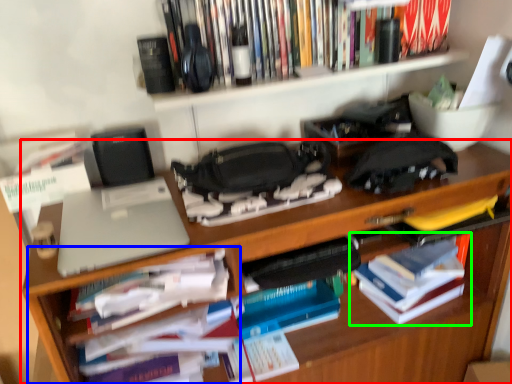
Question: Considering the real-world distances, which object is farthest from desk (highlighted by a red box)? cabinet (highlighted by a blue box) or book (highlighted by a green box)?

Choices:
 (A) cabinet
 (B) book

Answer: (A)